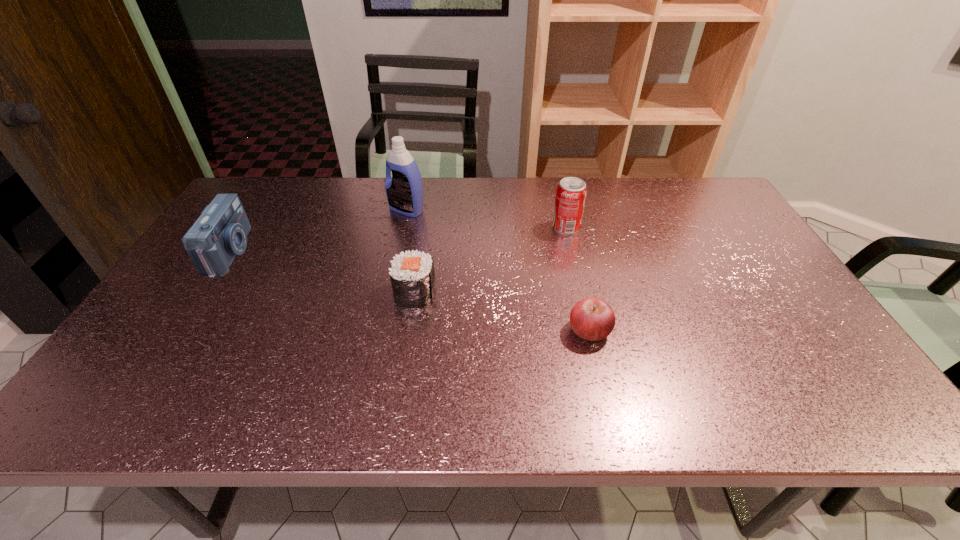
This screenshot has height=540, width=960. I want to click on free space between the soda can and the sushi, so click(491, 260).

The height and width of the screenshot is (540, 960). Identify the location of vacant space in between the farthest object and the leftmost object. (319, 231).

Find the location of a particular element. The image size is (960, 540). free space between the sushi and the soda can is located at coordinates (491, 260).

Where is `free area in between the leftmost object and the sushi`? This screenshot has width=960, height=540. free area in between the leftmost object and the sushi is located at coordinates (323, 273).

Where is `empty space between the nearest object and the soda can`? The image size is (960, 540). empty space between the nearest object and the soda can is located at coordinates (578, 279).

Identify the location of blank region between the tallest object and the soda can. The image size is (960, 540). (487, 219).

I want to click on free space between the detergent and the soda can, so click(487, 219).

Find the location of a particular element. unoccupied area between the farthest object and the sushi is located at coordinates (411, 251).

The width and height of the screenshot is (960, 540). I want to click on free space between the sushi and the soda can, so click(491, 260).

Point out which object is positioned as the third nearest to the camera. Please provide its 2D coordinates. Your answer should be formatted as a tuple, i.e. [(x, y)], where the tuple contains the x and y coordinates of a point satisfying the conditions above.

[(592, 319)]